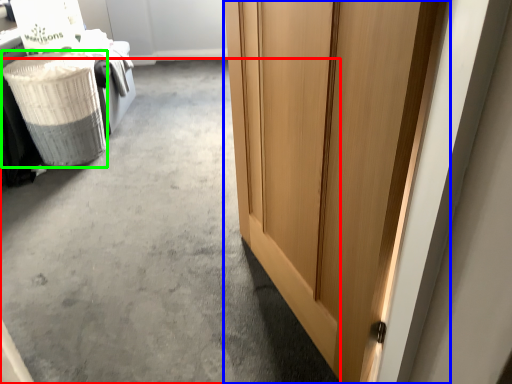
Question: Considering the real-world distances, which object is farthest from concrete (highlighted by a red box)? door (highlighted by a blue box) or laundry basket (highlighted by a green box)?

Choices:
 (A) door
 (B) laundry basket

Answer: (A)